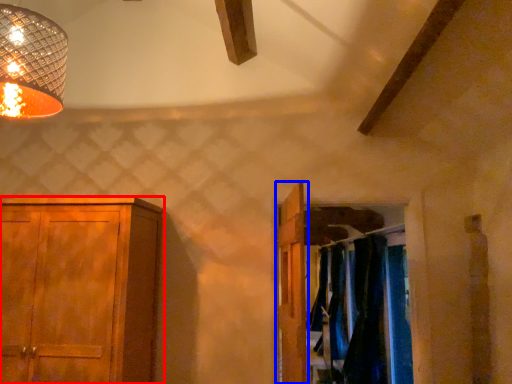
Question: Among these objects, which one is nearest to the camera, cupboard (highlighted by a red box) or door (highlighted by a blue box)?

Choices:
 (A) cupboard
 (B) door

Answer: (B)